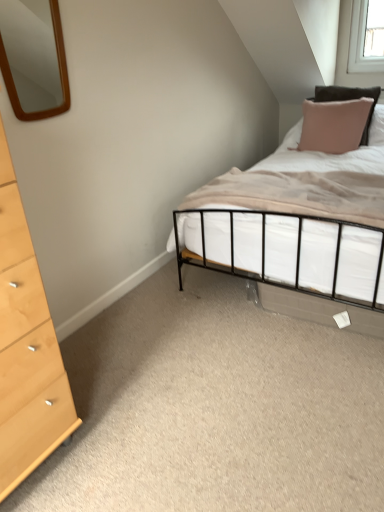
Question: Considering the positions of pink fabric pillow at upper right and light wood/texture chest of drawers at left in the image, is pink fabric pillow at upper right bigger or smaller than light wood/texture chest of drawers at left?

Choices:
 (A) big
 (B) small

Answer: (B)

Question: Which is correct: pink fabric pillow at upper right is inside light wood/texture chest of drawers at left, or outside of it?

Choices:
 (A) outside
 (B) inside

Answer: (A)

Question: Considering the real-world distances, which object is farthest from the beige fabric mattress at center?

Choices:
 (A) light wood/texture chest of drawers at left
 (B) pink fabric pillow at upper right
 (C) wooden mirror at upper left

Answer: (C)

Question: Which object is the farthest from the light wood/texture chest of drawers at left?

Choices:
 (A) pink fabric pillow at upper right
 (B) beige fabric mattress at center
 (C) wooden mirror at upper left

Answer: (C)